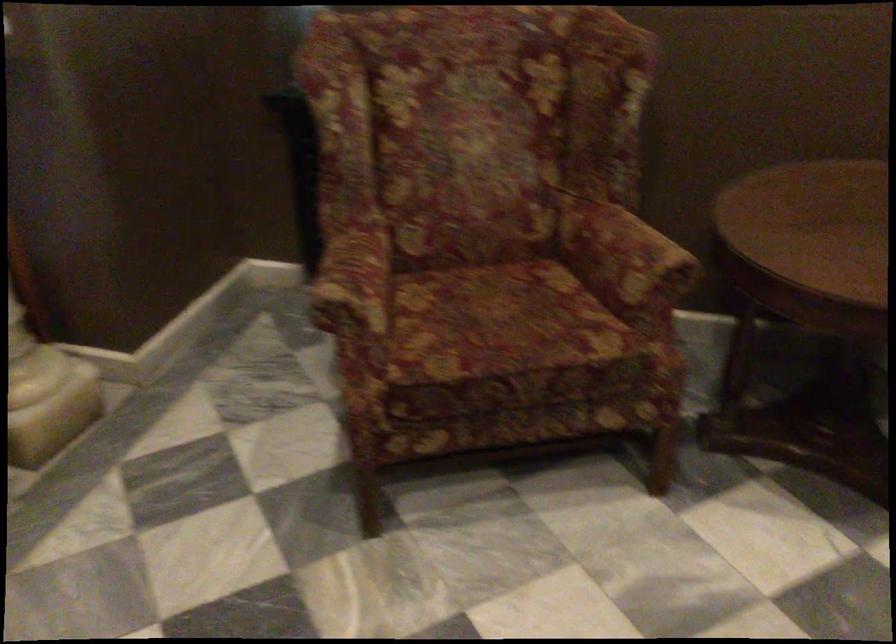
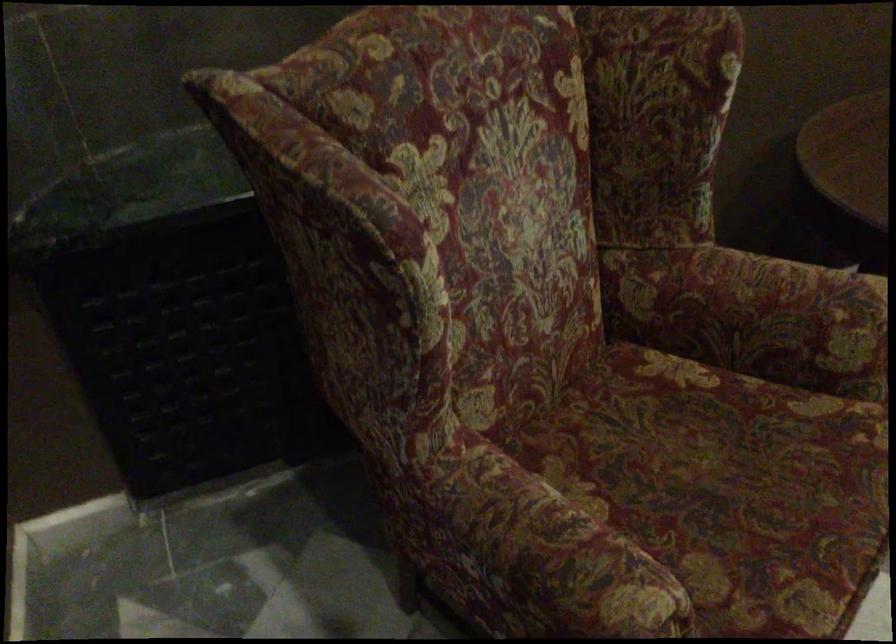
The point at (616,260) is marked in the first image. Where is the corresponding point in the second image?

(786, 321)